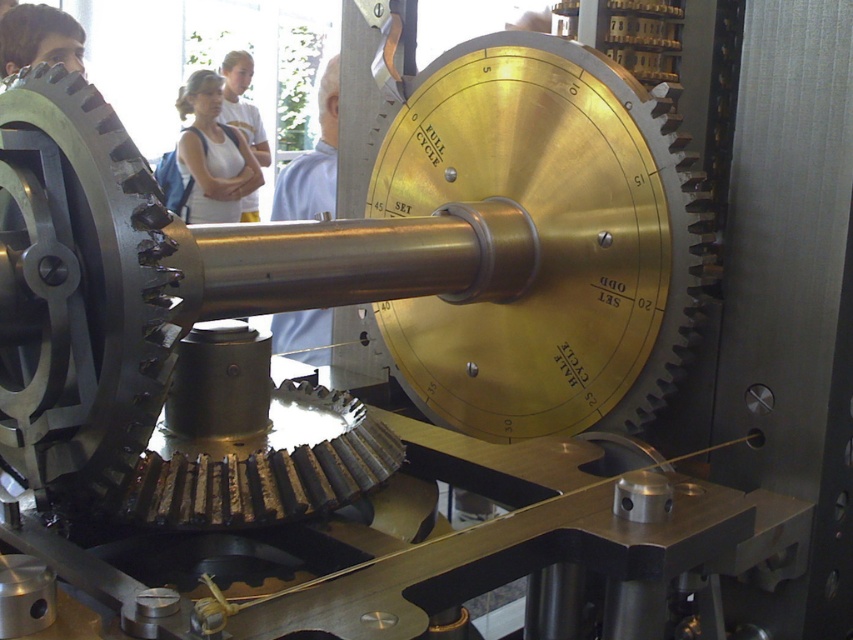
You are an assistant organizing a clothing store and need to arrange the white shirt at upper center and the white cotton shirt at upper left. According to the layout, which shirt is positioned to the right of the other?

The white shirt at upper center is positioned to the right of the white cotton shirt at upper left.

You are standing in front of the mechanical device and need to locate the white cotton shirt at upper left. According to the coordinates provided, where exactly is it positioned?

The white cotton shirt at upper left is positioned at coordinates point [212,154].

You are a technician standing 5 feet away from the mechanical device. You need to reach both the matte black gear at upper left and the white cotton shirt at upper center to perform maintenance. Can you comfortably reach both without moving your position?

The matte black gear at upper left and the white cotton shirt at upper center are 3.96 feet apart. Since you are standing 5 feet away from the mechanical device, you can comfortably reach both objects without needing to move your position as the distance between them is less than your standing distance.